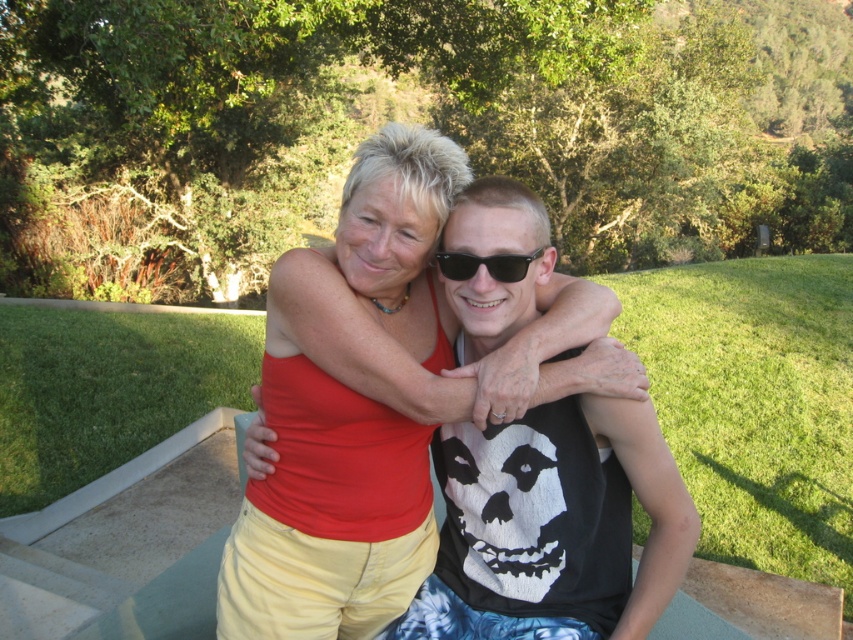
Does matte red tank top at center appear on the left side of black plastic sunglasses at center?

Correct, you'll find matte red tank top at center to the left of black plastic sunglasses at center.

Is matte red tank top at center below black plastic sunglasses at center?

Indeed, matte red tank top at center is positioned under black plastic sunglasses at center.

Where is `matte red tank top at center`? matte red tank top at center is located at coordinates (553, 525).

At what (x,y) coordinates should I click in order to perform the action: click on matte red tank top at center. Please return your answer as a coordinate pair (x, y). This screenshot has height=640, width=853. Looking at the image, I should click on (553, 525).